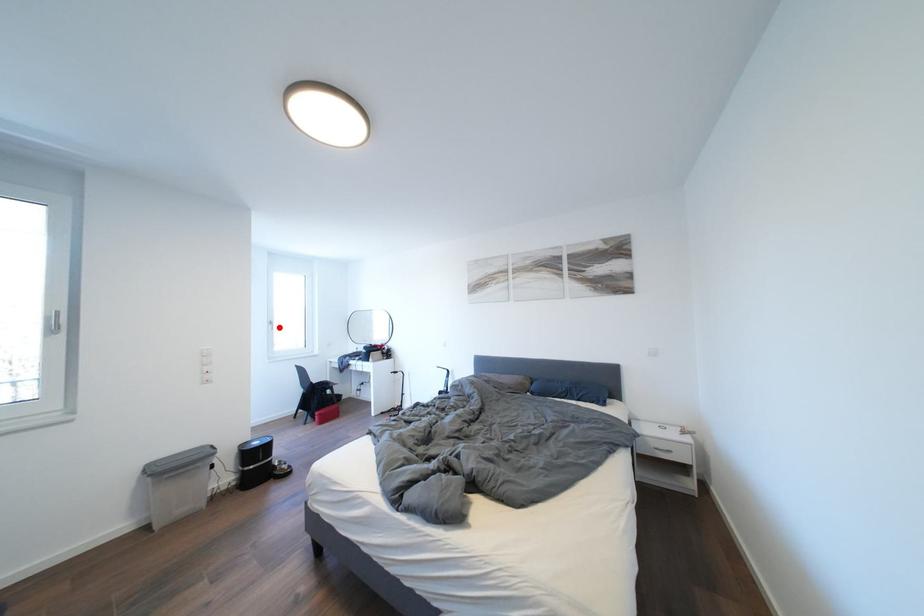
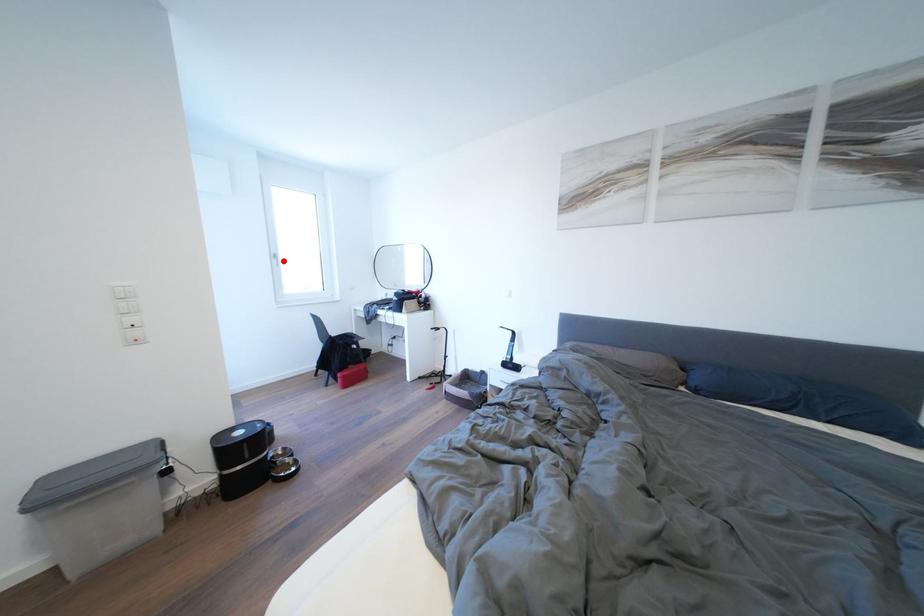
I am providing you with two images of the same scene from different viewpoints. A red point is marked on the first image and another point is marked on the second image. Is the red point in image1 aligned with the point shown in image2?

Yes